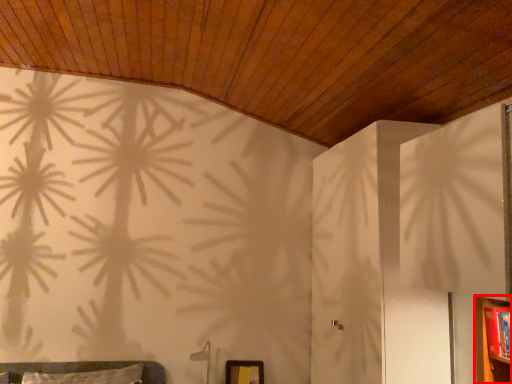
Question: From the image's perspective, considering the relative positions of dresser (annotated by the red box) and picture frame in the image provided, where is dresser (annotated by the red box) located with respect to the staircase?

Choices:
 (A) below
 (B) above

Answer: (B)